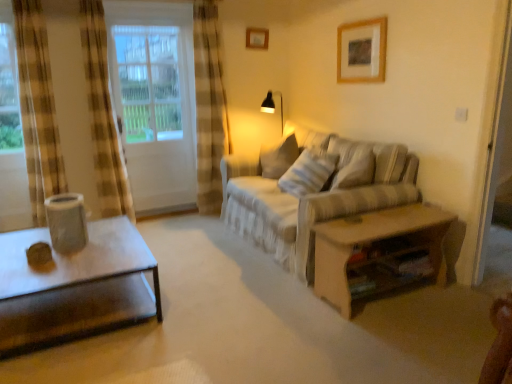
Question: Does beige fabric couch at center lie in front of matte black table lamp at upper center?

Choices:
 (A) yes
 (B) no

Answer: (A)

Question: Is beige fabric couch at center with matte black table lamp at upper center?

Choices:
 (A) yes
 (B) no

Answer: (B)

Question: From the image's perspective, does beige fabric couch at center appear higher than matte black table lamp at upper center?

Choices:
 (A) no
 (B) yes

Answer: (A)

Question: From a real-world perspective, is beige fabric couch at center physically below matte black table lamp at upper center?

Choices:
 (A) yes
 (B) no

Answer: (A)

Question: Does beige fabric couch at center have a lesser height compared to matte black table lamp at upper center?

Choices:
 (A) yes
 (B) no

Answer: (B)

Question: Can you confirm if beige fabric couch at center is thinner than matte black table lamp at upper center?

Choices:
 (A) yes
 (B) no

Answer: (B)

Question: Is wooden picture frame at upper center, marked as the 2th picture frame in a front-to-back arrangement, taller than wooden picture frame at upper center, the second picture frame from the left?

Choices:
 (A) no
 (B) yes

Answer: (A)

Question: Is the surface of wooden picture frame at upper center, arranged as the first picture frame when viewed from the left, in direct contact with wooden picture frame at upper center, the first picture frame in the front-to-back sequence?

Choices:
 (A) yes
 (B) no

Answer: (B)

Question: Is wooden picture frame at upper center, which ranks as the 1th picture frame in top-to-bottom order, facing towards wooden picture frame at upper center, positioned as the 1th picture frame in bottom-to-top order?

Choices:
 (A) yes
 (B) no

Answer: (A)

Question: Can you confirm if wooden picture frame at upper center, acting as the first picture frame starting from the back, is positioned to the left of wooden picture frame at upper center, the second picture frame from the left?

Choices:
 (A) yes
 (B) no

Answer: (A)

Question: From a real-world perspective, is wooden picture frame at upper center, the 2th picture frame in the bottom-to-top sequence, on top of wooden picture frame at upper center, which is counted as the second picture frame, starting from the back?

Choices:
 (A) yes
 (B) no

Answer: (A)

Question: Can wooden picture frame at upper center, the second picture frame from the left, be found inside wooden picture frame at upper center, arranged as the first picture frame when viewed from the left?

Choices:
 (A) no
 (B) yes

Answer: (A)

Question: From the image's perspective, is wooden picture frame at upper center, which ranks as the 1th picture frame in top-to-bottom order, above white striped fabric pillow at center?

Choices:
 (A) yes
 (B) no

Answer: (A)